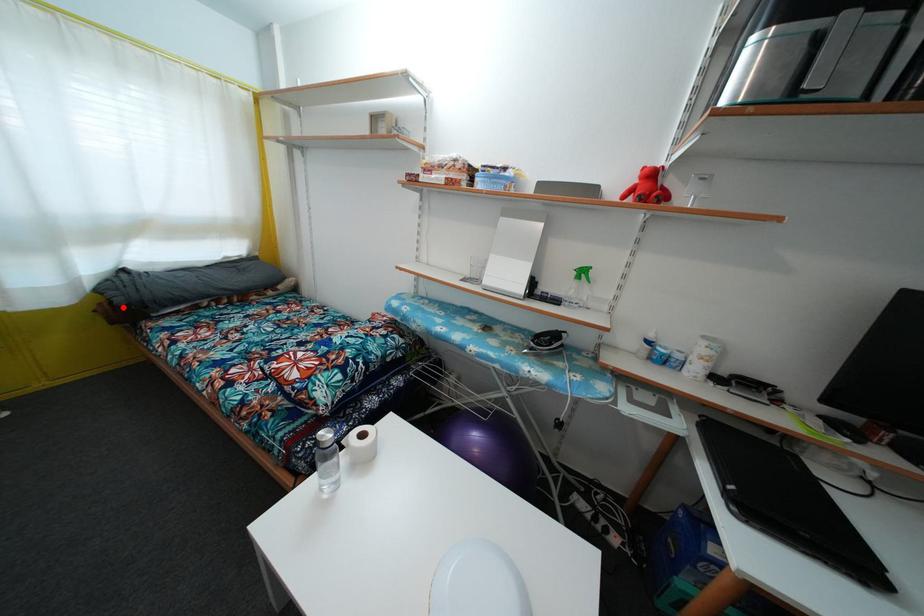
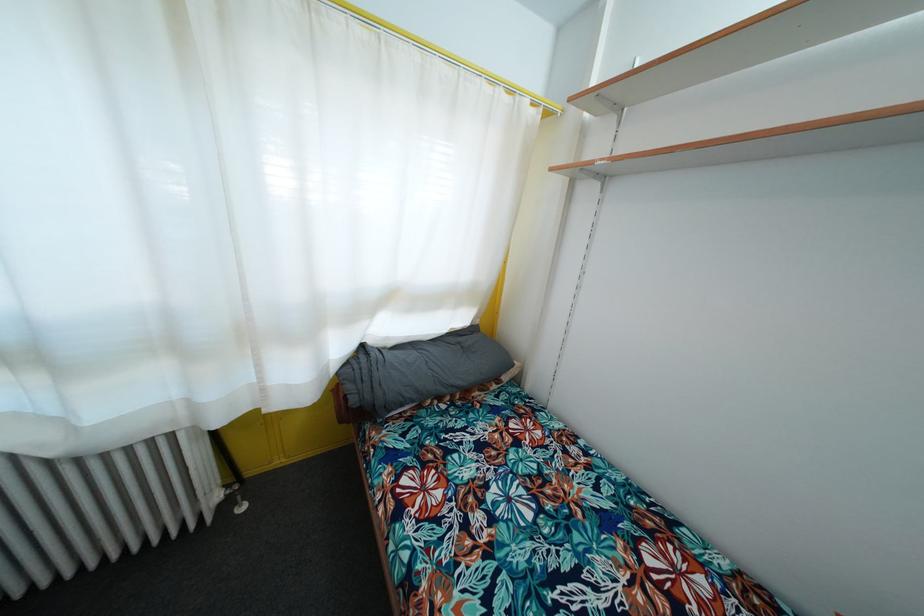
Where in the second image is the point corresponding to the highlighted location from the first image?

(358, 407)